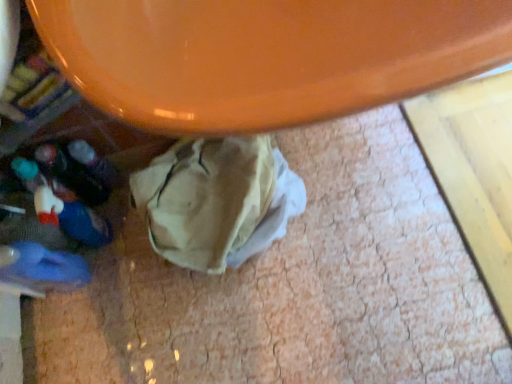
The width and height of the screenshot is (512, 384). I want to click on vacant area that is in front of blue rubber slipper at lower left, so click(86, 336).